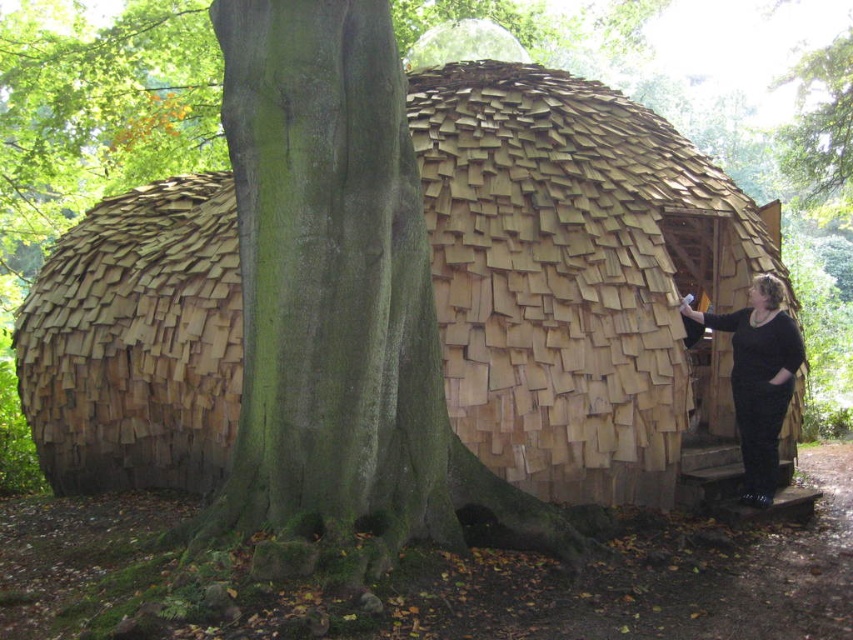
Based on the photo, you are standing in the forest and want to find the entrance to the dome shelter. According to the image, where is the green rough bark tree trunk at center located in relation to the shelter?

The green rough bark tree trunk at center is located at point [329,291], which means it is positioned near the base of the shelter, indicating the entrance is likely near this area.

You are standing in front of the dome shelter and notice two points marked on the structure. The first point is at coordinates point (27, 348) and the second is at point (738, 346). Which of these points is closer to your current position?

Point (27, 348) is closer to your current position because it is further to the camera than point (738, 346).

You are an explorer navigating through the forest and see the wooden shingles hut at center and the black matte clothing at right. Which object is closer to you according to the scene?

The wooden shingles hut at center is closer to you because it is in front of the black matte clothing at right.